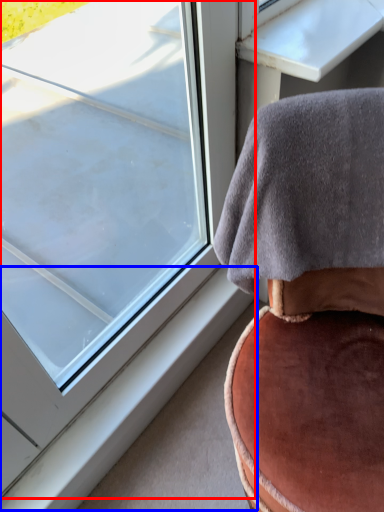
Question: Which object is further to the camera taking this photo, window (highlighted by a red box) or window sill (highlighted by a blue box)?

Choices:
 (A) window
 (B) window sill

Answer: (B)